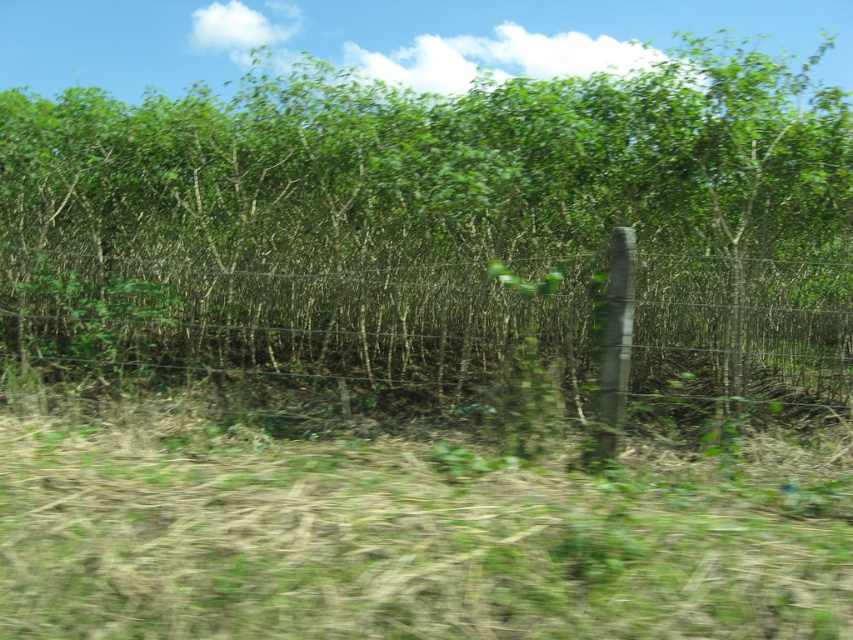
You are standing at the edge of the wire fence in the foreground. You see the green leafy tree at center and the green grass at lower center. Which object is positioned to the right of the other?

The green leafy tree at center is to the right of green grass at lower center.

You are a gardener who needs to mow the green grass at lower center. To reach it, you must pass through the wire mesh fence at center. Is the grass located to the right or left side of the fence?

The green grass at lower center is to the right of the wire mesh fence at center, so the grass is on the right side of the fence.